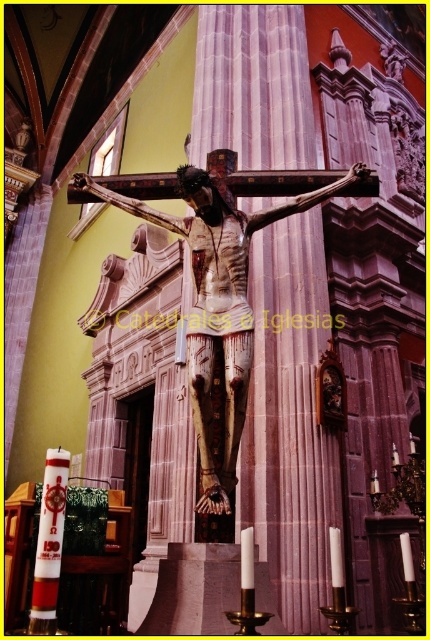
Does point (159, 221) come farther from viewer compared to point (43, 544)?

Yes, it is.

Is point (285, 212) farther from camera compared to point (49, 609)?

Yes, it is.

Where is `wooden crucifix at center`? wooden crucifix at center is located at coordinates (218, 305).